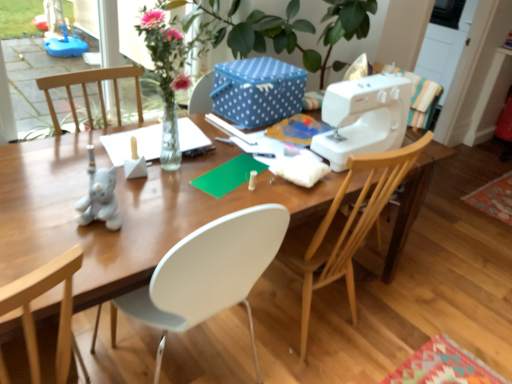
Question: Can you confirm if white plastic sewing machine at right is smaller than wooden chair at right?

Choices:
 (A) no
 (B) yes

Answer: (B)

Question: From a real-world perspective, is white plastic sewing machine at right beneath wooden chair at right?

Choices:
 (A) no
 (B) yes

Answer: (A)

Question: Is white plastic sewing machine at right wider than wooden chair at right?

Choices:
 (A) no
 (B) yes

Answer: (A)

Question: Does white plastic sewing machine at right have a lesser width compared to wooden chair at right?

Choices:
 (A) yes
 (B) no

Answer: (A)

Question: Is white plastic sewing machine at right with wooden chair at right?

Choices:
 (A) no
 (B) yes

Answer: (A)

Question: Is blue dotted fabric box at upper center to the left or to the right of wooden desk at center in the image?

Choices:
 (A) left
 (B) right

Answer: (B)

Question: Considering their positions, is blue dotted fabric box at upper center located in front of or behind wooden desk at center?

Choices:
 (A) front
 (B) behind

Answer: (B)

Question: In terms of width, does blue dotted fabric box at upper center look wider or thinner when compared to wooden desk at center?

Choices:
 (A) thin
 (B) wide

Answer: (A)

Question: From their relative heights in the image, would you say blue dotted fabric box at upper center is taller or shorter than wooden desk at center?

Choices:
 (A) short
 (B) tall

Answer: (A)

Question: From the image's perspective, is wooden chair at right positioned above or below white plastic sewing machine at right?

Choices:
 (A) above
 (B) below

Answer: (B)

Question: Does point (395, 178) appear closer or farther from the camera than point (348, 140)?

Choices:
 (A) closer
 (B) farther

Answer: (A)

Question: In the image, is wooden chair at right on the left side or the right side of white plastic sewing machine at right?

Choices:
 (A) left
 (B) right

Answer: (A)

Question: From a real-world perspective, is wooden chair at right positioned above or below white plastic sewing machine at right?

Choices:
 (A) above
 (B) below

Answer: (B)

Question: In terms of width, does wooden chair at right look wider or thinner when compared to blue dotted fabric box at upper center?

Choices:
 (A) thin
 (B) wide

Answer: (B)

Question: From a real-world perspective, is wooden chair at right positioned above or below blue dotted fabric box at upper center?

Choices:
 (A) above
 (B) below

Answer: (B)